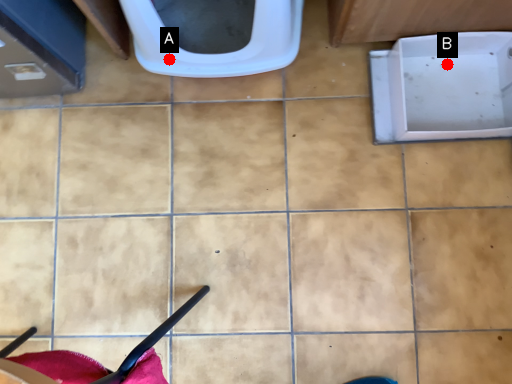
Question: Two points are circled on the image, labeled by A and B beside each circle. Which point is farther from the camera taking this photo?

Choices:
 (A) A is further
 (B) B is further

Answer: (B)